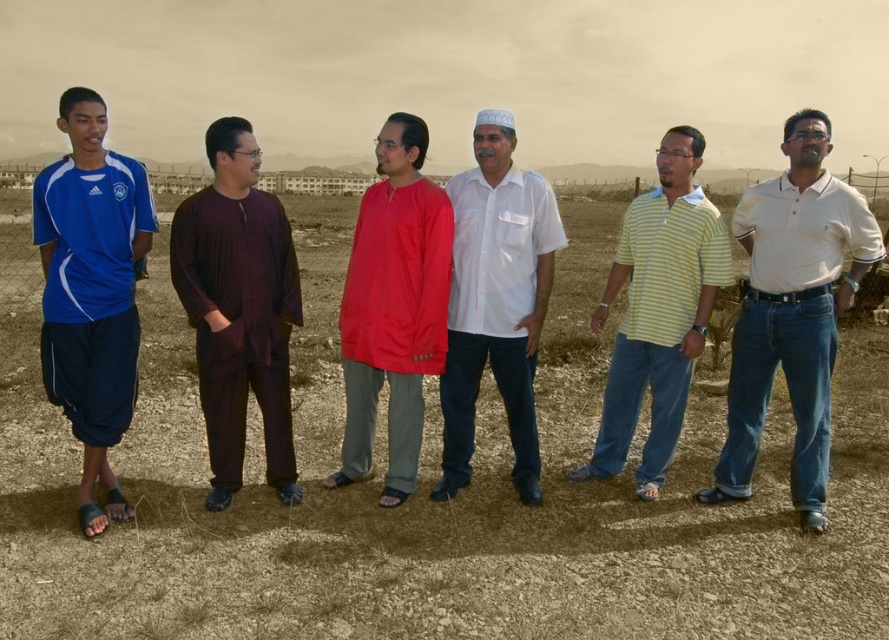
Question: Which point is farther to the camera?

Choices:
 (A) blue jersey at left
 (B) matte red shirt at center
 (C) brown dirt field at center

Answer: (B)

Question: In this image, where is brown dirt field at center located relative to white cotton polo shirt at center?

Choices:
 (A) left
 (B) right

Answer: (A)

Question: Can you confirm if blue jersey at left is positioned above yellow striped polo shirt at center?

Choices:
 (A) yes
 (B) no

Answer: (A)

Question: Is white cotton polo shirt at center closer to camera compared to matte red shirt at center?

Choices:
 (A) no
 (B) yes

Answer: (B)

Question: Which is nearer to the white cotton shirt at center?

Choices:
 (A) matte red shirt at center
 (B) brown dirt field at center

Answer: (A)

Question: Which object is farther from the camera taking this photo?

Choices:
 (A) brown dirt field at center
 (B) yellow striped polo shirt at center
 (C) matte red shirt at center

Answer: (B)